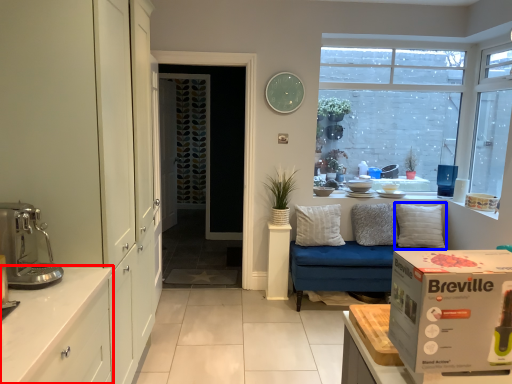
Question: Which object is closer to the camera taking this photo, cabinetry (highlighted by a red box) or pillow (highlighted by a blue box)?

Choices:
 (A) cabinetry
 (B) pillow

Answer: (A)